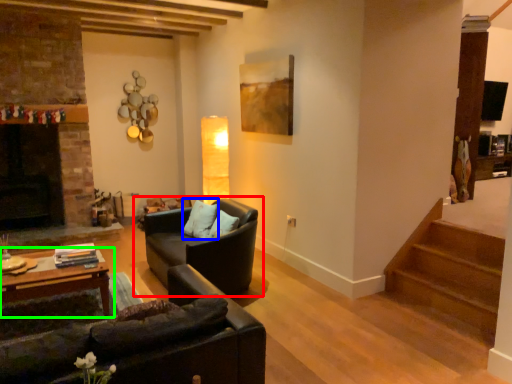
Question: Based on their relative distances, which object is farther from studio couch (highlighted by a red box)? Choose from pillow (highlighted by a blue box) and table (highlighted by a green box).

Choices:
 (A) pillow
 (B) table

Answer: (B)